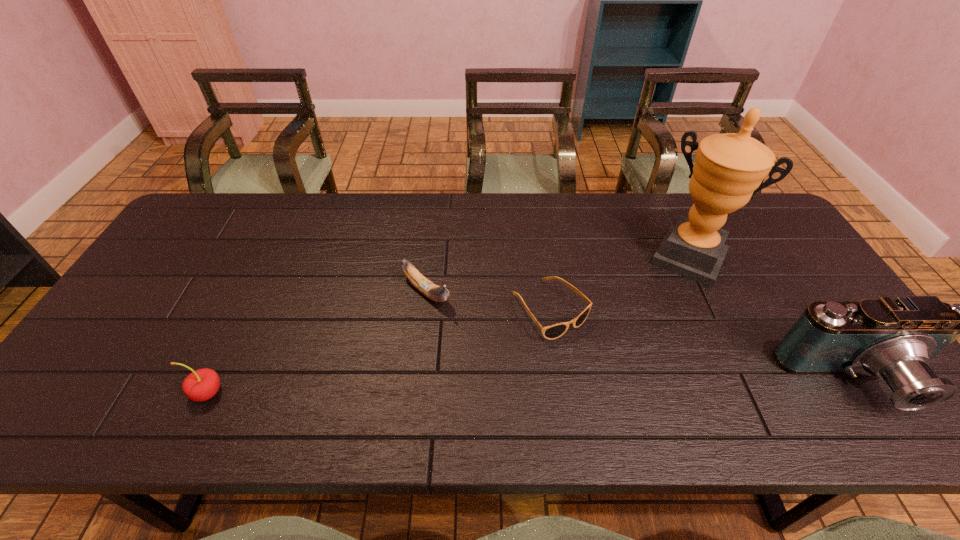
Locate an element on the screen. The height and width of the screenshot is (540, 960). free region located at the front of the tallest object with handles is located at coordinates (668, 301).

Find the location of `free space located at the stem of the second shortest object`. free space located at the stem of the second shortest object is located at coordinates (492, 352).

I want to click on free space located at the stem of the second shortest object, so click(507, 364).

Identify the location of vacant region located 0.180m at the stem of the second shortest object. This screenshot has height=540, width=960. (490, 349).

Where is `vacant point located on the front-facing side of the third object from right to left`? vacant point located on the front-facing side of the third object from right to left is located at coordinates (626, 393).

Find the location of a particular element. vacant position located 0.170m on the front-facing side of the third object from right to left is located at coordinates (622, 389).

Locate an element on the screen. object that is at the far edge is located at coordinates (729, 168).

Identify the location of object that is at the near edge. (200, 385).

The image size is (960, 540). In order to click on free space at the far edge of the desktop in this screenshot , I will do `click(649, 209)`.

At what (x,y) coordinates should I click in order to perform the action: click on free point at the near edge. Please return your answer as a coordinate pair (x, y). Looking at the image, I should click on (386, 372).